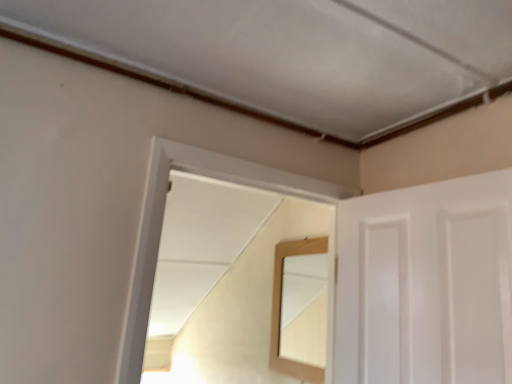
What do you see at coordinates (161, 223) in the screenshot? I see `wooden frame at center` at bounding box center [161, 223].

Locate an element on the screen. wooden frame at center is located at coordinates (161, 223).

This screenshot has height=384, width=512. Identify the location of wooden frame at center. (161, 223).